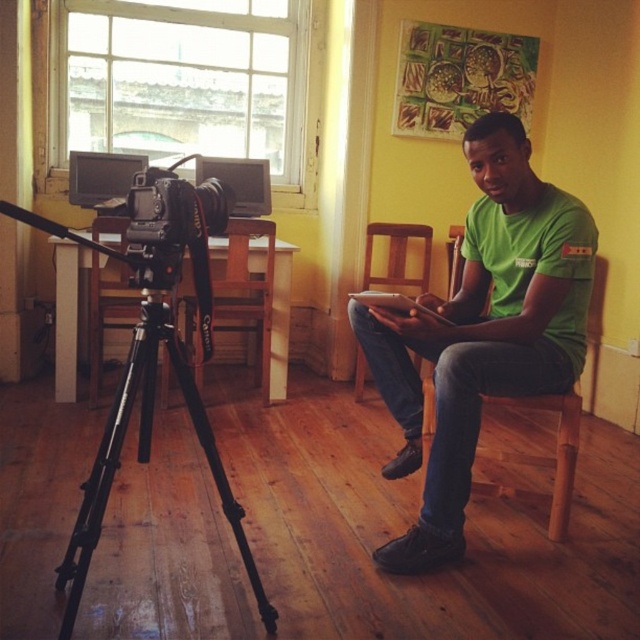
Question: Does black metallic tripod at lower left have a smaller size compared to wooden chair at center?

Choices:
 (A) no
 (B) yes

Answer: (B)

Question: Can you confirm if wooden chair at center is positioned above black wood chair at left?

Choices:
 (A) no
 (B) yes

Answer: (A)

Question: Can you confirm if black metallic tripod at lower left is thinner than matte black tablet at center?

Choices:
 (A) yes
 (B) no

Answer: (B)

Question: Which object is farther from the camera taking this photo?

Choices:
 (A) wooden at right
 (B) black wood chair at left

Answer: (A)

Question: Which object is positioned farthest from the wooden at right?

Choices:
 (A) black metallic tripod at lower left
 (B) black wood chair at left

Answer: (A)

Question: Which point appears farthest from the camera in this image?

Choices:
 (A) (385, 307)
 (B) (84, 518)
 (C) (268, 248)
 (D) (456, 234)

Answer: (D)